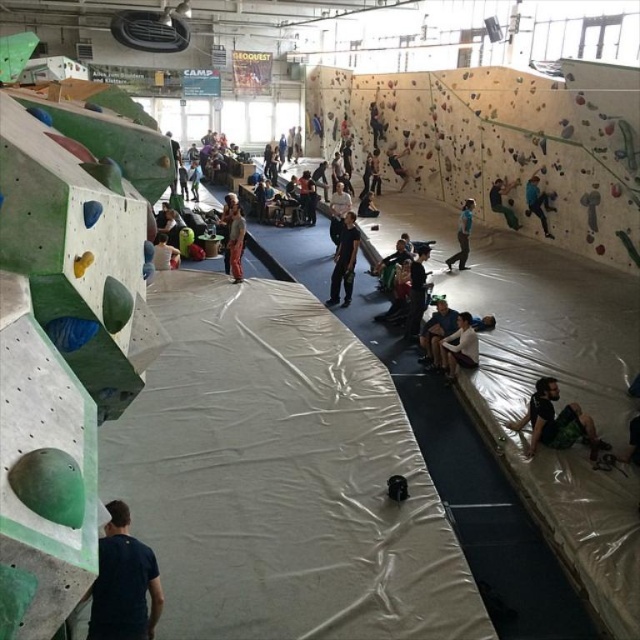
In the scene shown: Who is more forward, [531,198] or [472,198]?

Point [531,198]

Does dark blue shirt at upper right have a greater height compared to blue fabric pants at center?

Correct, dark blue shirt at upper right is much taller as blue fabric pants at center.

Identify the location of dark blue shirt at upper right. The height and width of the screenshot is (640, 640). (538, 202).

The height and width of the screenshot is (640, 640). Identify the location of dark blue shirt at upper right. 538,202.

Between white fabric at center and matte black helmet at upper center, which one appears on the right side from the viewer's perspective?

matte black helmet at upper center

Which is in front, point (467, 324) or point (401, 168)?

Point (467, 324) is more forward.

The image size is (640, 640). In order to click on white fabric at center in this screenshot , I will do `click(460, 348)`.

Does dark blue shirt at center lie behind light brown fabric shirt at center?

That is False.

Is dark blue shirt at center thinner than light brown fabric shirt at center?

Incorrect, dark blue shirt at center's width is not less than light brown fabric shirt at center's.

Locate an element on the screen. This screenshot has height=640, width=640. dark blue shirt at center is located at coordinates (436, 332).